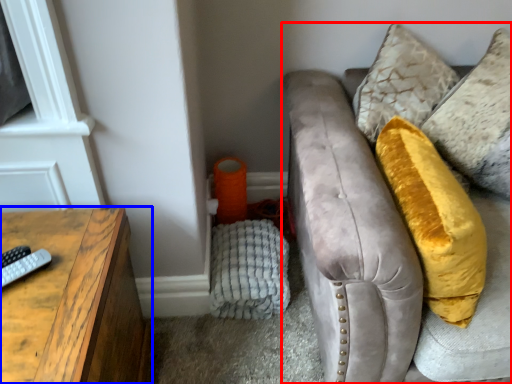
Question: Among these objects, which one is farthest to the camera, studio couch (highlighted by a red box) or table (highlighted by a blue box)?

Choices:
 (A) studio couch
 (B) table

Answer: (A)